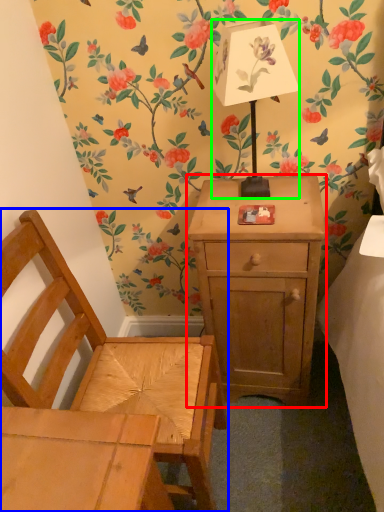
Question: Which object is the closest to the nightstand (highlighted by a red box)? Choose among these: chair (highlighted by a blue box) or table lamp (highlighted by a green box).

Choices:
 (A) chair
 (B) table lamp

Answer: (A)